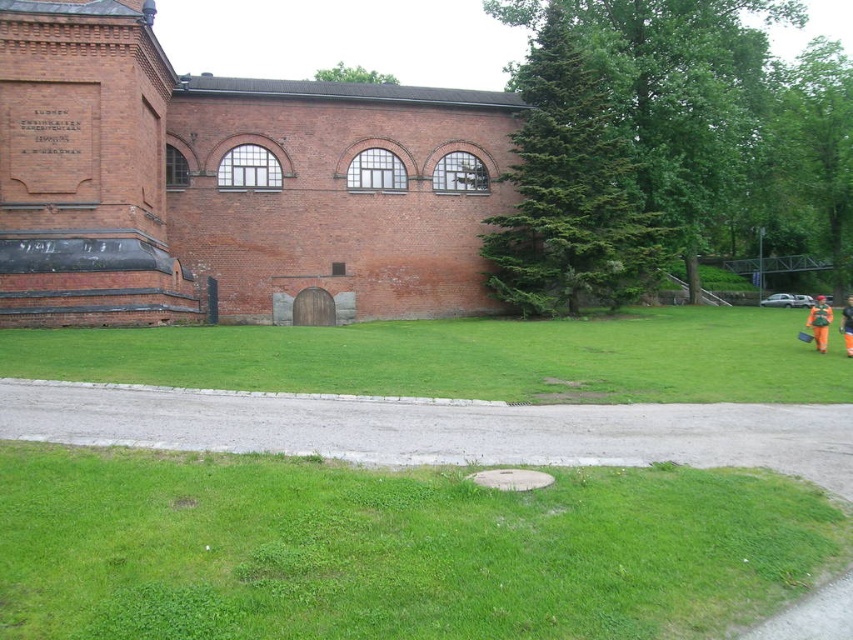
You are a pedestrian approaching the building and see the orange reflective vest at lower right and the orange reflective suit at right. Which one is closer to you?

The orange reflective vest at lower right is closer to you because the orange reflective suit at right is behind it.

You are a gardener who needs to mow the lawn. You see the green grass at lower center and the orange reflective vest at lower right. Which area should you mow first based on their height?

The green grass at lower center should be mowed first because it is not as tall as the orange reflective vest at lower right, indicating it needs attention before it grows taller.

You are standing in front of the brick building and want to walk towards the orange reflective suit at right. Which direction should you move to get closer to it without stepping on the green grass at lower center?

To avoid stepping on the green grass at lower center, you should move towards the right side of the paved pathway since the orange reflective suit at right is farther away from the viewer compared to the green grass at lower center. The pathway provides a clear path away from the grass.